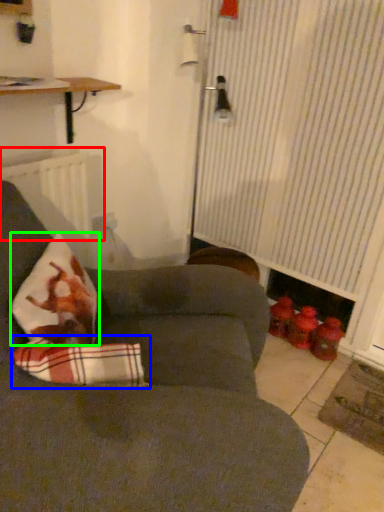
Question: Based on their relative distances, which object is farther from radiator (highlighted by a red box)? Choose from linen (highlighted by a blue box) and throw pillow (highlighted by a green box).

Choices:
 (A) linen
 (B) throw pillow

Answer: (A)